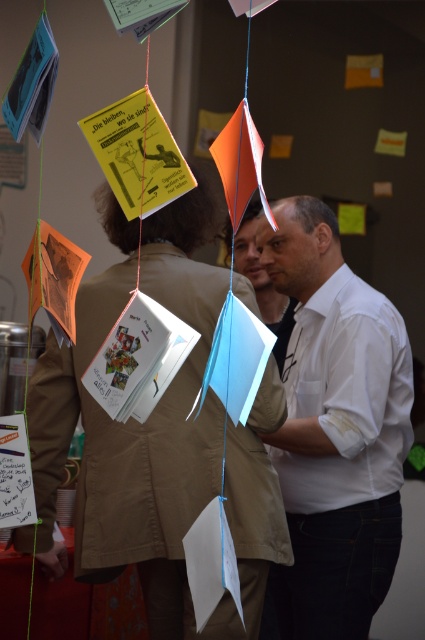
From the picture: Between khaki cotton jacket at center and white matte shirt at center, which one has less height?

Standing shorter between the two is khaki cotton jacket at center.

Which is behind, point (286, 556) or point (295, 225)?

Positioned behind is point (295, 225).

Identify the location of khaki cotton jacket at center. This screenshot has height=640, width=425. 156,435.